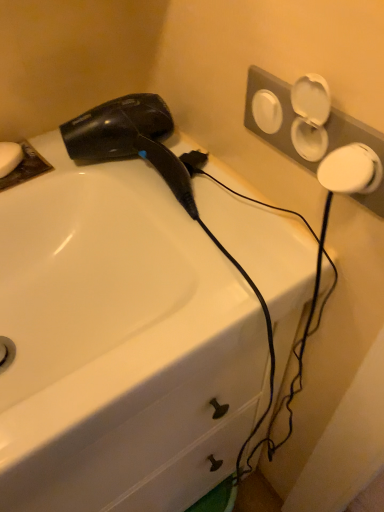
Identify the location of vacant location below black glossy hair dryer at upper left (from a real-world perspective). (136, 181).